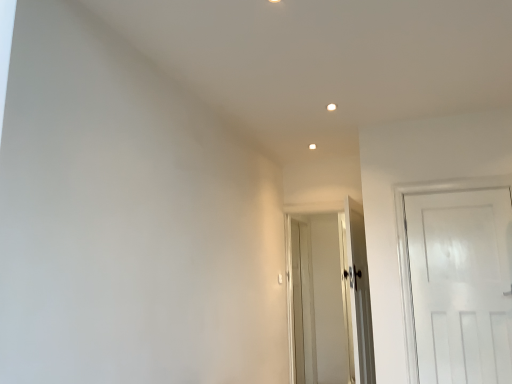
At what (x,y) coordinates should I click in order to perform the action: click on white glossy door at center, which is the second door from front to back. Please return your answer as a coordinate pair (x, y). The image size is (512, 384). Looking at the image, I should click on (359, 294).

I want to click on white glossy door at center, the second door in the back-to-front sequence, so click(359, 294).

From the image's perspective, is white matte door at right, the first door when ordered from front to back, on top of white wooden door at center, arranged as the third door when viewed from the front?

Yes.

Between white matte door at right, the first door when ordered from front to back, and white wooden door at center, which appears as the 1th door when viewed from the back, which one appears on the left side from the viewer's perspective?

From the viewer's perspective, white wooden door at center, which appears as the 1th door when viewed from the back, appears more on the left side.

Is white matte door at right, the first door when ordered from front to back, inside or outside of white wooden door at center, which appears as the 1th door when viewed from the back?

white matte door at right, the first door when ordered from front to back, is spatially situated outside white wooden door at center, which appears as the 1th door when viewed from the back.

Considering the sizes of objects white glossy door at center, which is the second door from front to back, and white matte door at right, which is counted as the 3th door, starting from the back, in the image provided, who is shorter, white glossy door at center, which is the second door from front to back, or white matte door at right, which is counted as the 3th door, starting from the back,?

white matte door at right, which is counted as the 3th door, starting from the back, is shorter.

Between white glossy door at center, which is the second door from front to back, and white matte door at right, which is counted as the 3th door, starting from the back, which one has smaller width?

With smaller width is white matte door at right, which is counted as the 3th door, starting from the back.

From a real-world perspective, is white glossy door at center, the second door in the back-to-front sequence, physically located above or below white matte door at right, the first door when ordered from front to back?

In terms of real-world spatial position, white glossy door at center, the second door in the back-to-front sequence, is below white matte door at right, the first door when ordered from front to back.

Is white glossy door at center, which is the second door from front to back, further to camera compared to white matte door at right, the first door when ordered from front to back?

Yes, white glossy door at center, which is the second door from front to back, is further from the viewer.

Can you confirm if white wooden door at center, which appears as the 1th door when viewed from the back, is thinner than white glossy door at center, the second door in the back-to-front sequence?

No.

From a real-world perspective, does white wooden door at center, arranged as the third door when viewed from the front, sit lower than white glossy door at center, which is the second door from front to back?

Yes, from a real-world perspective, white wooden door at center, arranged as the third door when viewed from the front, is under white glossy door at center, which is the second door from front to back.

From the image's perspective, which one is positioned lower, white wooden door at center, arranged as the third door when viewed from the front, or white glossy door at center, the second door in the back-to-front sequence?

white wooden door at center, arranged as the third door when viewed from the front, from the image's perspective.

In the image, is white wooden door at center, which appears as the 1th door when viewed from the back, on the left side or the right side of white glossy door at center, the second door in the back-to-front sequence?

In the image, white wooden door at center, which appears as the 1th door when viewed from the back, appears on the left side of white glossy door at center, the second door in the back-to-front sequence.

Is the depth of white wooden door at center, which appears as the 1th door when viewed from the back, greater than that of white matte door at right, the first door when ordered from front to back?

Yes.

From a real-world perspective, is white wooden door at center, which appears as the 1th door when viewed from the back, positioned above or below white matte door at right, which is counted as the 3th door, starting from the back?

white wooden door at center, which appears as the 1th door when viewed from the back, is below white matte door at right, which is counted as the 3th door, starting from the back.

Can you confirm if white wooden door at center, which appears as the 1th door when viewed from the back, is positioned to the left of white matte door at right, the first door when ordered from front to back?

Yes.

Identify the location of the 2nd door to the right when counting from the white wooden door at center, which appears as the 1th door when viewed from the back. Image resolution: width=512 pixels, height=384 pixels. (461, 285).

Looking at this image, which is nearer, (420, 222) or (358, 342)?

Positioned in front is point (420, 222).

Which of these two, white matte door at right, which is counted as the 3th door, starting from the back, or white glossy door at center, which is the second door from front to back, stands taller?

white glossy door at center, which is the second door from front to back, is taller.

Does white matte door at right, the first door when ordered from front to back, turn towards white glossy door at center, the second door in the back-to-front sequence?

No, white matte door at right, the first door when ordered from front to back, is not facing towards white glossy door at center, the second door in the back-to-front sequence.

From a real-world perspective, which door is the 1st one underneath the white matte door at right, the first door when ordered from front to back? Please provide its 2D coordinates.

[(359, 294)]

This screenshot has width=512, height=384. Identify the location of the 1st door located above the white wooden door at center, arranged as the third door when viewed from the front (from a real-world perspective). (359, 294).

How far apart are white glossy door at center, the second door in the back-to-front sequence, and white wooden door at center, which appears as the 1th door when viewed from the back?

white glossy door at center, the second door in the back-to-front sequence, and white wooden door at center, which appears as the 1th door when viewed from the back, are 33.48 inches apart from each other.

Looking at this image, from a real-world perspective, is white glossy door at center, which is the second door from front to back, physically above white wooden door at center, arranged as the third door when viewed from the front?

Correct, in the physical world, white glossy door at center, which is the second door from front to back, is higher than white wooden door at center, arranged as the third door when viewed from the front.

From the image's perspective, is white glossy door at center, which is the second door from front to back, on white wooden door at center, which appears as the 1th door when viewed from the back?

Yes.

From a real-world perspective, which door is the 2nd one above the white wooden door at center, arranged as the third door when viewed from the front? Please provide its 2D coordinates.

[(461, 285)]

Where is `door that is the 1st object located below the white matte door at right, the first door when ordered from front to back (from the image's perspective)`? door that is the 1st object located below the white matte door at right, the first door when ordered from front to back (from the image's perspective) is located at coordinates (359, 294).

From the image, which object appears to be nearer to white glossy door at center, the second door in the back-to-front sequence, white wooden door at center, which appears as the 1th door when viewed from the back, or white matte door at right, the first door when ordered from front to back?

white matte door at right, the first door when ordered from front to back.

From the picture: Looking at the image, which one is located further to white wooden door at center, which appears as the 1th door when viewed from the back, white glossy door at center, the second door in the back-to-front sequence, or white matte door at right, the first door when ordered from front to back?

white matte door at right, the first door when ordered from front to back.

Based on their spatial positions, is white glossy door at center, the second door in the back-to-front sequence, or white wooden door at center, arranged as the third door when viewed from the front, further from white matte door at right, the first door when ordered from front to back?

Among the two, white wooden door at center, arranged as the third door when viewed from the front, is located further to white matte door at right, the first door when ordered from front to back.

Considering their positions, is white wooden door at center, which appears as the 1th door when viewed from the back, positioned closer to white matte door at right, which is counted as the 3th door, starting from the back, than white glossy door at center, the second door in the back-to-front sequence?

Based on the image, white glossy door at center, the second door in the back-to-front sequence, appears to be nearer to white matte door at right, which is counted as the 3th door, starting from the back.

Which object lies nearer to the anchor point white wooden door at center, arranged as the third door when viewed from the front, white matte door at right, which is counted as the 3th door, starting from the back, or white glossy door at center, the second door in the back-to-front sequence?

white glossy door at center, the second door in the back-to-front sequence.

Based on their spatial positions, is white matte door at right, which is counted as the 3th door, starting from the back, or white wooden door at center, which appears as the 1th door when viewed from the back, closer to white glossy door at center, the second door in the back-to-front sequence?

Among the two, white matte door at right, which is counted as the 3th door, starting from the back, is located nearer to white glossy door at center, the second door in the back-to-front sequence.

Where is `door between white matte door at right, the first door when ordered from front to back, and white wooden door at center, which appears as the 1th door when viewed from the back, along the z-axis`? Image resolution: width=512 pixels, height=384 pixels. door between white matte door at right, the first door when ordered from front to back, and white wooden door at center, which appears as the 1th door when viewed from the back, along the z-axis is located at coordinates (359, 294).